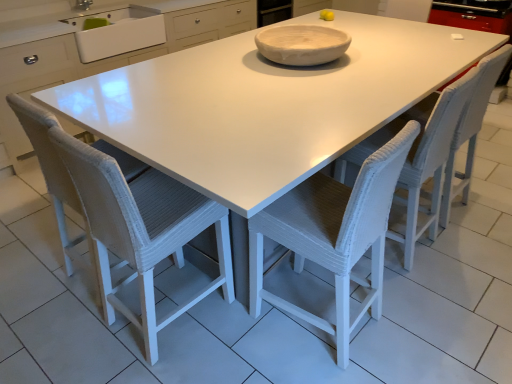
Question: Considering the positions of white matte bowl at center and white woven swivel chair at lower left in the image, is white matte bowl at center taller or shorter than white woven swivel chair at lower left?

Choices:
 (A) tall
 (B) short

Answer: (B)

Question: From the image's perspective, relative to white woven swivel chair at lower left, is white matte bowl at center above or below?

Choices:
 (A) below
 (B) above

Answer: (B)

Question: Estimate the real-world distances between objects in this image. Which object is closer to the white ceramic sink at upper left?

Choices:
 (A) white matte bowl at center
 (B) white woven chair at center, which is the second chair in right-to-left order
 (C) white woven chair at center, the 1th chair when ordered from right to left
 (D) white woven swivel chair at lower left
 (E) white woven chair at center, which is the first chair from left to right

Answer: (A)

Question: Which of these objects is positioned farthest from the white woven chair at center, which appears as the third chair when viewed from the right?

Choices:
 (A) white ceramic sink at upper left
 (B) white woven swivel chair at lower left
 (C) white woven chair at center, which is the second chair in right-to-left order
 (D) white woven chair at center, which is the third chair in left-to-right order
 (E) white matte bowl at center

Answer: (A)